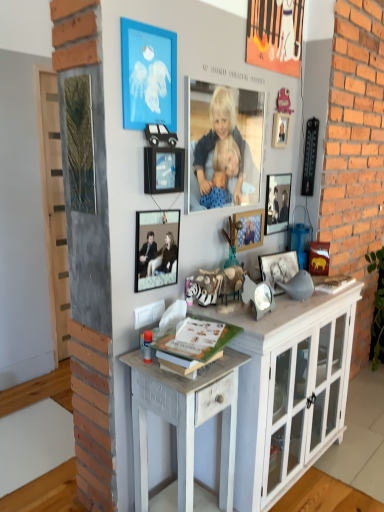
Question: Which direction should I rotate to look at metallic silver photo frame at center, which ranks as the 6th picture frame in left-to-right order, — up or down?

Choices:
 (A) down
 (B) up

Answer: (B)

Question: Considering the relative sizes of smooth blue fabric at center and blue matte picture frame at upper center, which is counted as the sixth picture frame, starting from the right, in the image provided, is smooth blue fabric at center taller than blue matte picture frame at upper center, which is counted as the sixth picture frame, starting from the right,?

Choices:
 (A) yes
 (B) no

Answer: (A)

Question: Considering the relative positions of smooth blue fabric at center and blue matte picture frame at upper center, which is counted as the sixth picture frame, starting from the right, in the image provided, is smooth blue fabric at center to the left of blue matte picture frame at upper center, which is counted as the sixth picture frame, starting from the right, from the viewer's perspective?

Choices:
 (A) yes
 (B) no

Answer: (B)

Question: Does smooth blue fabric at center have a lesser width compared to blue matte picture frame at upper center, which is counted as the first picture frame, starting from the left?

Choices:
 (A) no
 (B) yes

Answer: (A)

Question: Is smooth blue fabric at center outside blue matte picture frame at upper center, which is counted as the sixth picture frame, starting from the right?

Choices:
 (A) no
 (B) yes

Answer: (B)

Question: Can you confirm if smooth blue fabric at center is shorter than blue matte picture frame at upper center, which is counted as the sixth picture frame, starting from the right?

Choices:
 (A) yes
 (B) no

Answer: (B)

Question: From the image's perspective, does smooth blue fabric at center appear higher than blue matte picture frame at upper center, which is counted as the sixth picture frame, starting from the right?

Choices:
 (A) no
 (B) yes

Answer: (A)

Question: Is metallic silver photo frame at center, which ranks as the 6th picture frame in left-to-right order, looking in the opposite direction of black matte picture frame at center, which is the 2th picture frame from right to left?

Choices:
 (A) no
 (B) yes

Answer: (A)

Question: From a real-world perspective, is metallic silver photo frame at center, which ranks as the 6th picture frame in left-to-right order, physically above black matte picture frame at center, the fifth picture frame viewed from the left?

Choices:
 (A) yes
 (B) no

Answer: (A)

Question: Does metallic silver photo frame at center, placed as the first picture frame when sorted from right to left, have a lesser height compared to black matte picture frame at center, which is the 2th picture frame from right to left?

Choices:
 (A) yes
 (B) no

Answer: (B)

Question: Is metallic silver photo frame at center, placed as the first picture frame when sorted from right to left, thinner than black matte picture frame at center, the fifth picture frame viewed from the left?

Choices:
 (A) yes
 (B) no

Answer: (A)

Question: Can you confirm if metallic silver photo frame at center, placed as the first picture frame when sorted from right to left, is taller than black matte picture frame at center, which is the 2th picture frame from right to left?

Choices:
 (A) yes
 (B) no

Answer: (A)

Question: Is metallic silver photo frame at center, placed as the first picture frame when sorted from right to left, at the left side of black matte picture frame at center, which is the 2th picture frame from right to left?

Choices:
 (A) no
 (B) yes

Answer: (A)

Question: Is white distressed wood desk at center not close to smooth blue fabric at center?

Choices:
 (A) no
 (B) yes

Answer: (A)